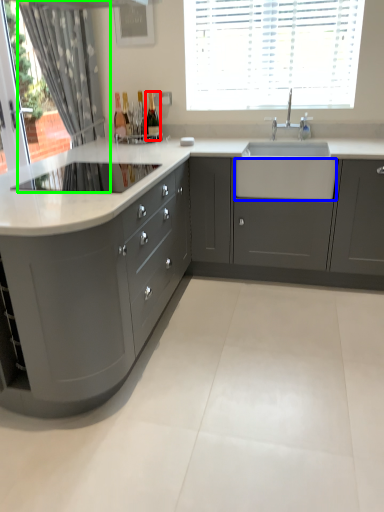
Question: Estimate the real-world distances between objects in this image. Which object is farther from bottle (highlighted by a red box), drawer (highlighted by a blue box) or curtain (highlighted by a green box)?

Choices:
 (A) drawer
 (B) curtain

Answer: (A)